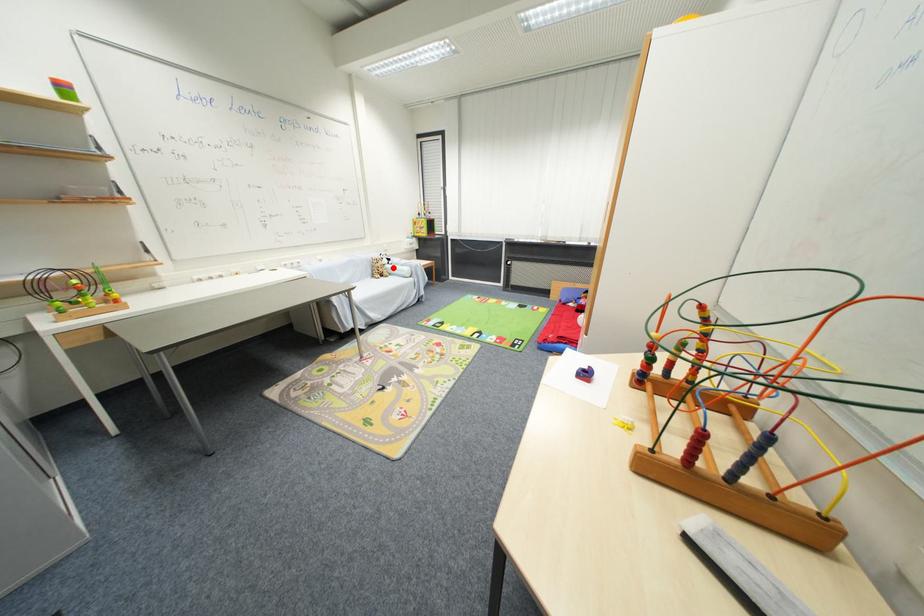
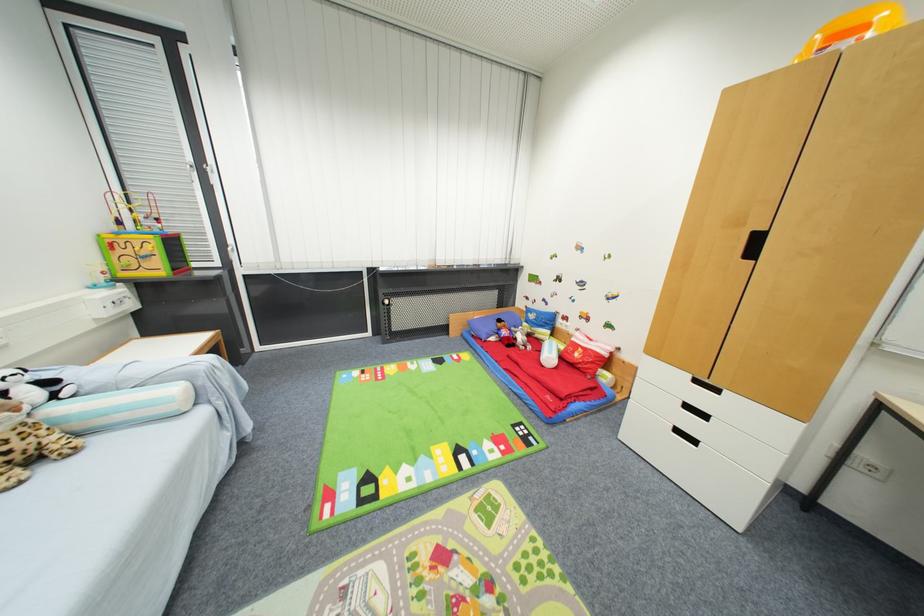
Locate, in the second image, the point that corresponds to the highlighted location in the first image.

(64, 411)